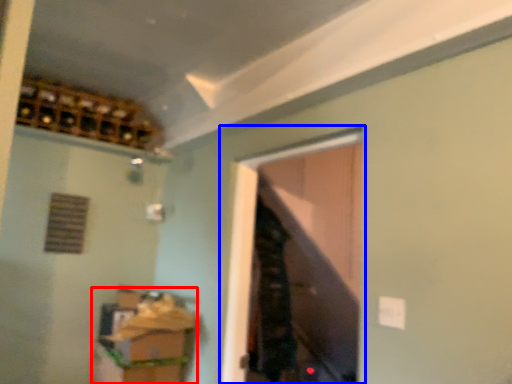
Question: Which of the following is the closest to the observer, cabinetry (highlighted by a red box) or window (highlighted by a blue box)?

Choices:
 (A) cabinetry
 (B) window

Answer: (B)